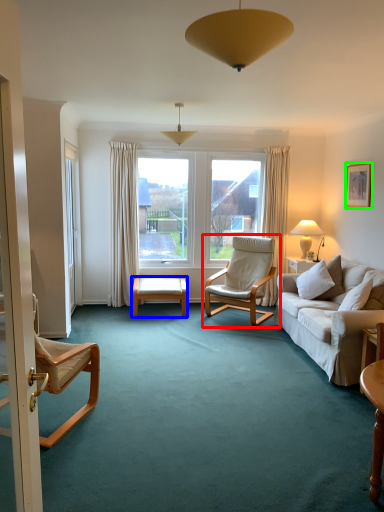
Question: Estimate the real-world distances between objects in this image. Which object is farther from chair (highlighted by a red box), table (highlighted by a blue box) or picture frame (highlighted by a green box)?

Choices:
 (A) table
 (B) picture frame

Answer: (B)